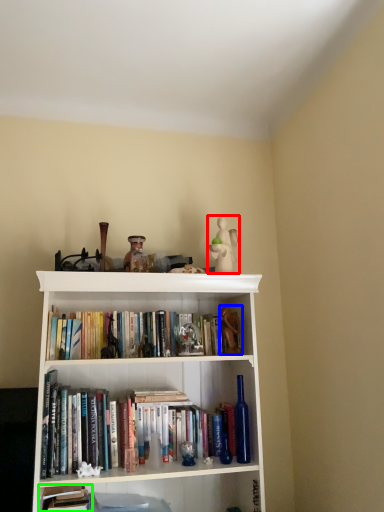
Question: Which object is the closest to the toy (highlighted by a red box)? Choose among these: toy (highlighted by a blue box) or book (highlighted by a green box).

Choices:
 (A) toy
 (B) book

Answer: (A)